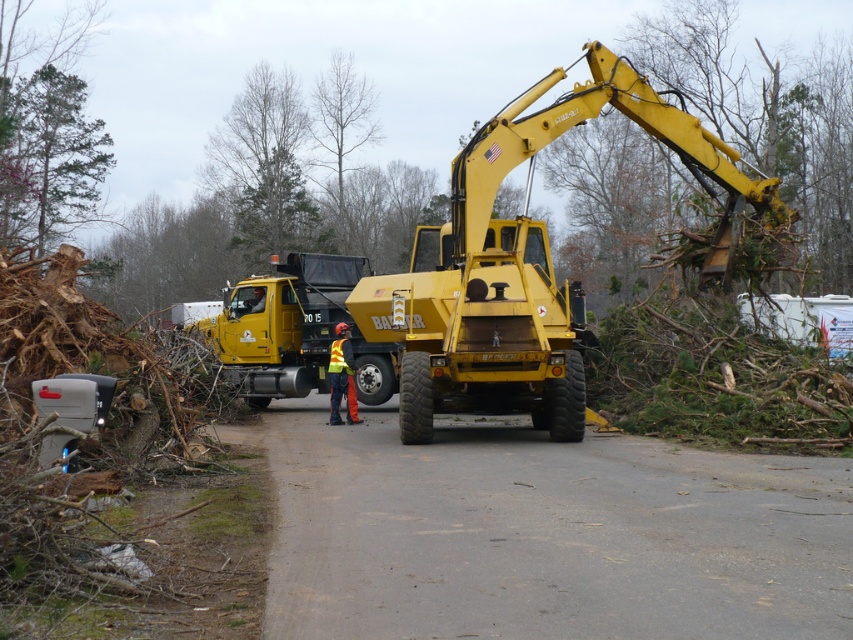
You are a safety inspector reviewing this cleanup site. You notice the green leafy tree at upper left and the reflective yellow vest at center. Which object is closer to your current position as you look at the scene?

The green leafy tree at upper left is closer to your current position because it is further to the viewer than the reflective yellow vest at center, meaning it appears nearer in the visual perspective.

Consider the image. You are a worker standing at point (x=20, y=168) and need to walk to point (x=660, y=92). Which direction should you move relative to your current position?

You should move forward because point (x=660, y=92) is in front of point (x=20, y=168).